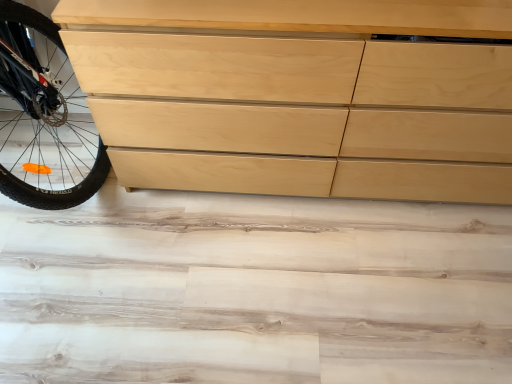
The height and width of the screenshot is (384, 512). What are the coordinates of `free space above wooden dresser at upper left (from a real-world perspective)` in the screenshot? It's located at (222, 264).